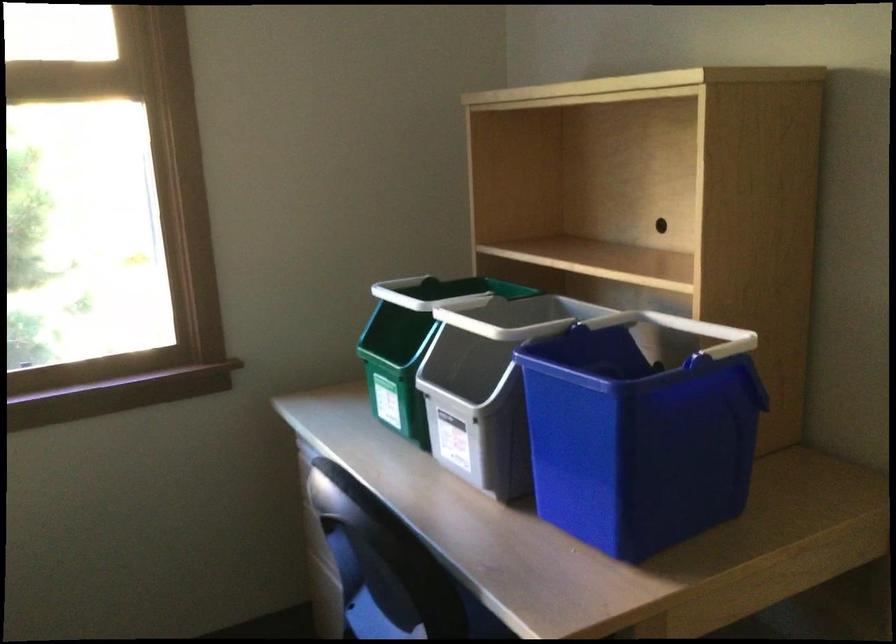
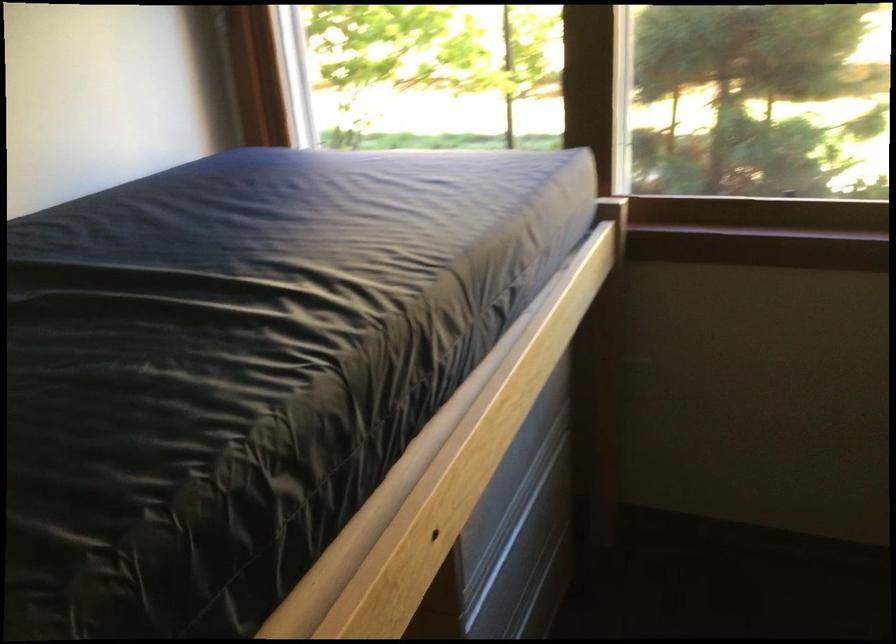
How did the camera likely rotate?

The rotation direction of the camera is left-down.